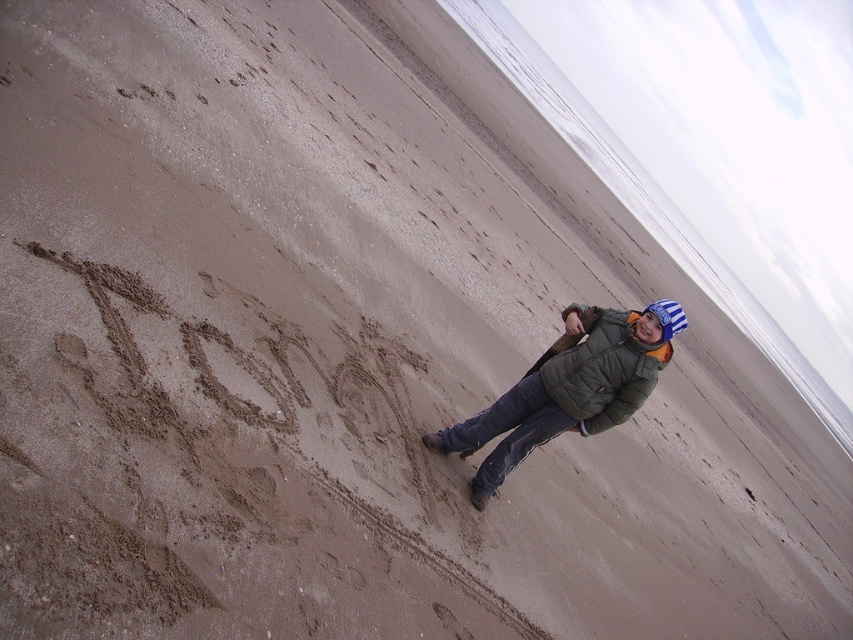
You are a photographer trying to capture the word written in the sand. You see the green fuzzy jacket at center and the green matte jacket at lower right. Which jacket is closer to the word written on the sand?

The green fuzzy jacket at center is closer to the word written on the sand because it is positioned to the left of the green matte jacket at lower right, and the word LOVE is located to the left of the person.

You are standing at the origin point in the coordinate system of the image. There are two points marked in the scene. Which point is closer to you, point (508, 461) or point (595, 397)?

Point (595, 397) is closer to you because it is in front of point (508, 461).

You are a photographer trying to capture both the green fuzzy jacket at center and the green matte jacket at lower right in the same frame. Given that your camera has a maximum focus range of 4 inches, will you be able to include both jackets in a single photo without moving the camera?

The distance between the green fuzzy jacket at center and the green matte jacket at lower right is 4.67 inches, which exceeds the camera maximum focus range of 4 inches. Therefore, you cannot capture both jackets in the same frame without moving the camera.